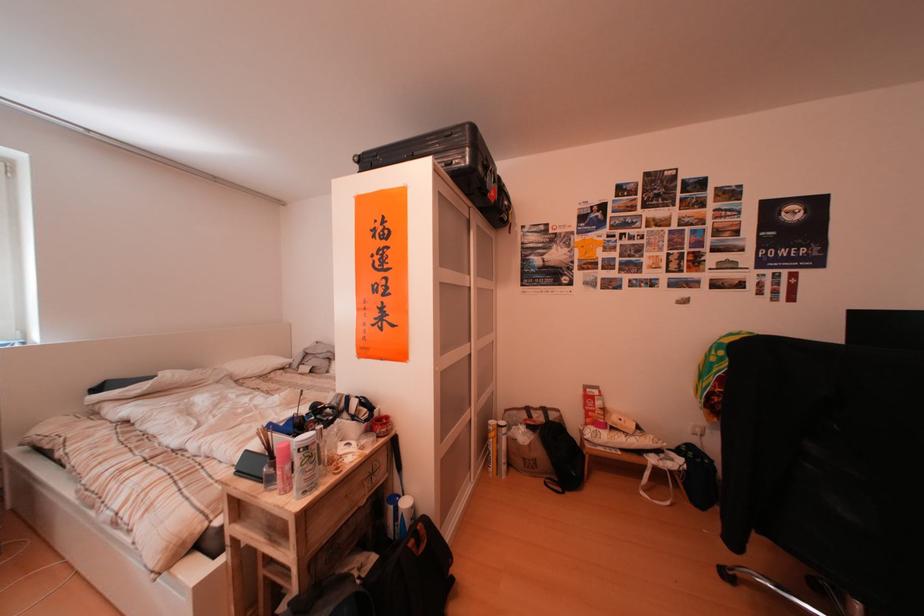
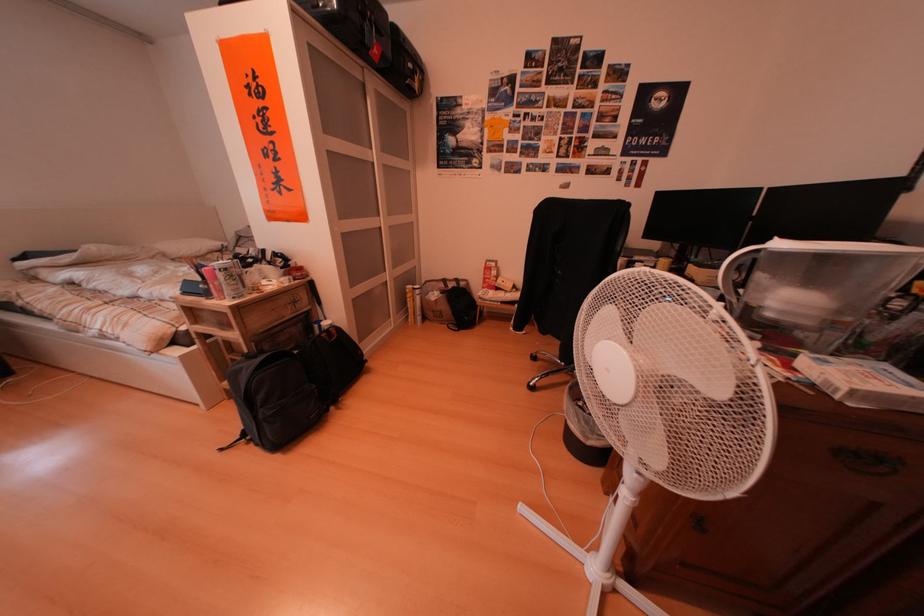
The images are taken continuously from a first-person perspective. In which direction are you moving?

The cameraman moved toward right, backward.